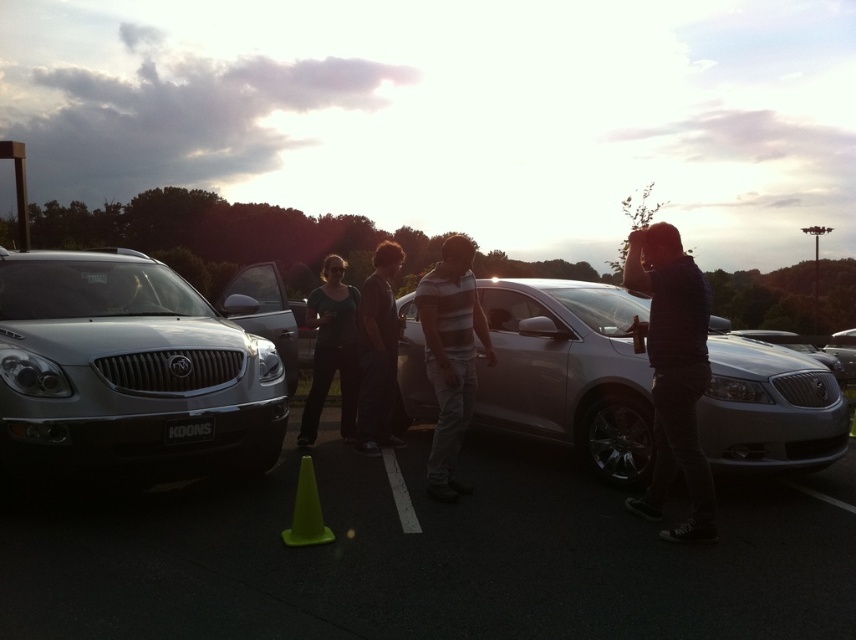
How far apart are green plastic cone at center and matte black shirt at center?

green plastic cone at center and matte black shirt at center are 2.77 meters apart.

Is green plastic cone at center below matte black shirt at center?

Correct, green plastic cone at center is located below matte black shirt at center.

Is point (233, 577) closer to camera compared to point (331, 262)?

Yes, point (233, 577) is closer to viewer.

Image resolution: width=856 pixels, height=640 pixels. Find the location of `green plastic cone at center`. green plastic cone at center is located at coordinates (432, 557).

Who is positioned more to the left, satin silver sedan at center or striped cotton shirt at center?

From the viewer's perspective, striped cotton shirt at center appears more on the left side.

Does satin silver sedan at center have a lesser height compared to striped cotton shirt at center?

No, satin silver sedan at center is not shorter than striped cotton shirt at center.

The height and width of the screenshot is (640, 856). I want to click on satin silver sedan at center, so click(568, 371).

You are a GUI agent. You are given a task and a screenshot of the screen. Output one action in this format:
    pyautogui.click(x=<x>, y=<y>)
    Task: Click on the satin silver sedan at center
    The width and height of the screenshot is (856, 640).
    Given the screenshot: What is the action you would take?
    pyautogui.click(x=568, y=371)

Does green plastic cone at center have a lesser width compared to satin silver suv at left?

Yes.

From the picture: Is green plastic cone at center to the left of satin silver suv at left from the viewer's perspective?

In fact, green plastic cone at center is to the right of satin silver suv at left.

Is point (500, 621) positioned in front of point (10, 285)?

That is True.

You are a GUI agent. You are given a task and a screenshot of the screen. Output one action in this format:
    pyautogui.click(x=<x>, y=<y>)
    Task: Click on the green plastic cone at center
    
    Given the screenshot: What is the action you would take?
    pyautogui.click(x=432, y=557)